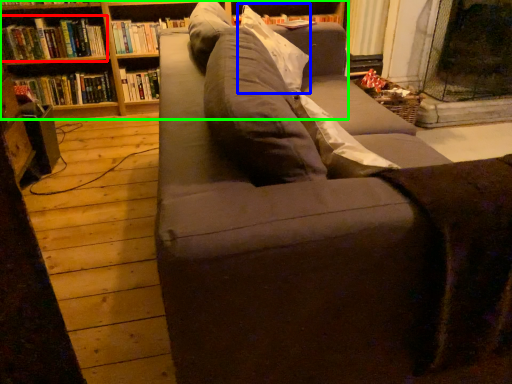
Question: Estimate the real-world distances between objects in this image. Which object is farther from book (highlighted by a red box), pillow (highlighted by a blue box) or bookcase (highlighted by a green box)?

Choices:
 (A) pillow
 (B) bookcase

Answer: (A)